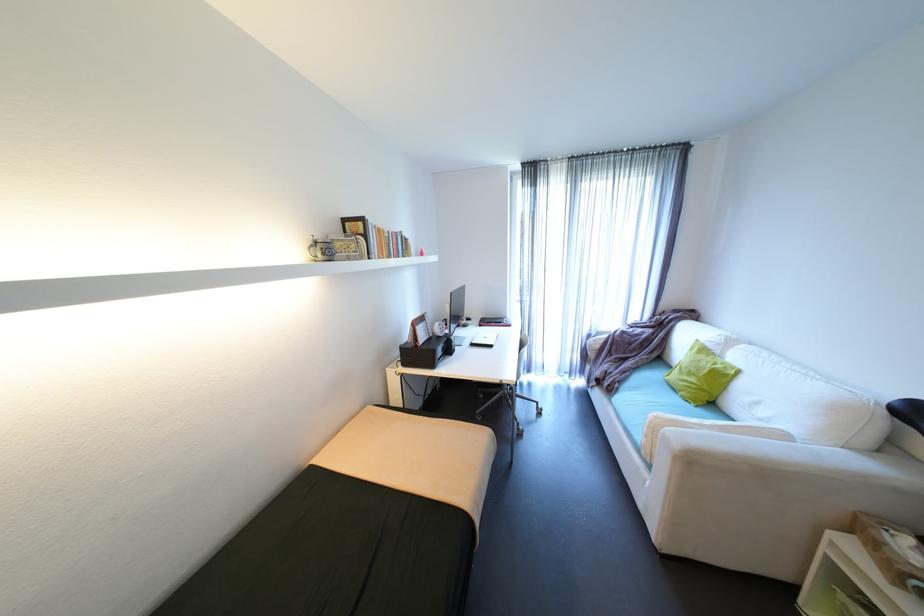
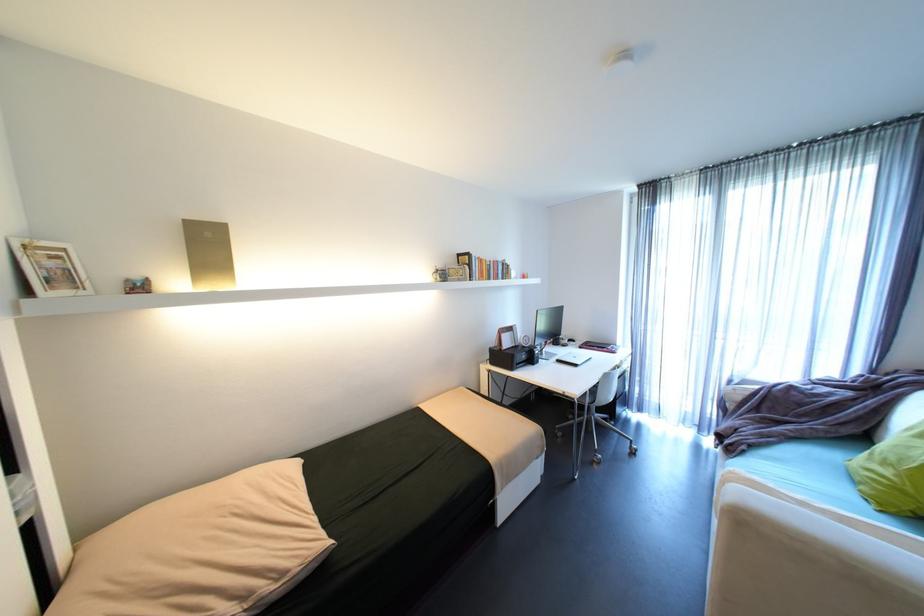
Question: How did the camera likely rotate?

Choices:
 (A) Left
 (B) Right
 (C) Up
 (D) Down

Answer: (A)